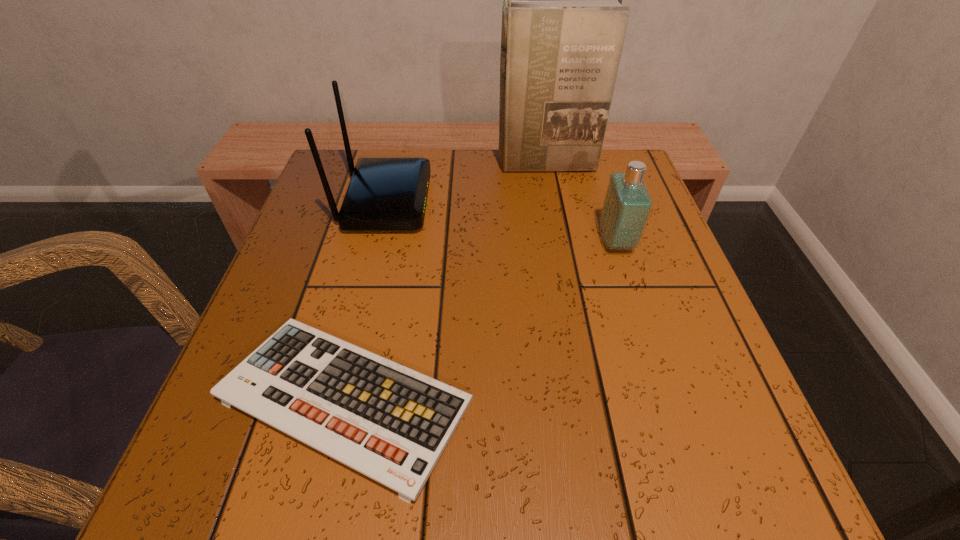
This screenshot has height=540, width=960. In order to click on object present at the far right corner in this screenshot , I will do `click(563, 26)`.

The width and height of the screenshot is (960, 540). In the image, there is a desktop. In order to click on blank space at the far edge in this screenshot , I will do `click(468, 152)`.

Find the location of a particular element. This screenshot has width=960, height=540. vacant area at the left edge of the desktop is located at coordinates [316, 209].

Identify the location of free space at the right edge of the desktop. The height and width of the screenshot is (540, 960). (675, 325).

This screenshot has width=960, height=540. In order to click on blank space at the far left corner in this screenshot , I will do `click(335, 161)`.

Locate an element on the screen. vacant space at the near left corner of the desktop is located at coordinates (237, 492).

The image size is (960, 540). I want to click on free space at the near right corner of the desktop, so click(x=775, y=503).

At what (x,y) coordinates should I click in order to perform the action: click on free spot between the third tallest object and the computer keyboard. Please return your answer as a coordinate pair (x, y). The width and height of the screenshot is (960, 540). Looking at the image, I should click on (481, 321).

This screenshot has height=540, width=960. I want to click on unoccupied area between the tallest object and the perfume, so click(581, 203).

This screenshot has width=960, height=540. Find the location of `vacant point located between the tallest object and the nearest object`. vacant point located between the tallest object and the nearest object is located at coordinates (445, 282).